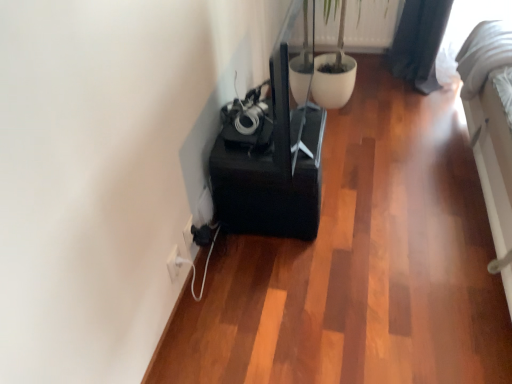
Identify the location of white plastic electric outlet at lower left, marked as the 2th electric outlet in a back-to-front arrangement. (174, 263).

Locate an element on the screen. white plastic electric outlet at lower left, which is the 2th electric outlet in left-to-right order is located at coordinates (190, 239).

What is the approximate height of green matte plant at upper center?

green matte plant at upper center is 32.08 centimeters in height.

Where is `white plastic electric outlet at lower left, marked as the 2th electric outlet in a back-to-front arrangement`? white plastic electric outlet at lower left, marked as the 2th electric outlet in a back-to-front arrangement is located at coordinates (174, 263).

Is white plastic electric outlet at lower left, marked as the 2th electric outlet in a back-to-front arrangement, to the left or to the right of green matte plant at upper center in the image?

white plastic electric outlet at lower left, marked as the 2th electric outlet in a back-to-front arrangement, is to the left of green matte plant at upper center.

Which electric outlet is the 2nd one when counting from the left side of the green matte plant at upper center? Please provide its 2D coordinates.

[(174, 263)]

Does white plastic electric outlet at lower left, which is the 2th electric outlet from right to left, have a larger size compared to green matte plant at upper center?

Incorrect, white plastic electric outlet at lower left, which is the 2th electric outlet from right to left, is not larger than green matte plant at upper center.

Would you consider white plastic electric outlet at lower left, the 2th electric outlet from the front, to be distant from green matte plant at upper center?

Yes, white plastic electric outlet at lower left, the 2th electric outlet from the front, and green matte plant at upper center are located far from each other.

Is white plastic electric outlet at lower left, the 1th electric outlet from the right, positioned with its back to green matte plant at upper center?

That's not correct — white plastic electric outlet at lower left, the 1th electric outlet from the right, is not looking away from green matte plant at upper center.

Is the depth of white plastic electric outlet at lower left, the 1th electric outlet viewed from the back, less than that of green matte plant at upper center?

That is True.

Is green matte plant at upper center wider than white plastic electric outlet at lower left, placed as the 1th electric outlet when sorted from front to back?

Correct, the width of green matte plant at upper center exceeds that of white plastic electric outlet at lower left, placed as the 1th electric outlet when sorted from front to back.

From the image's perspective, is green matte plant at upper center on white plastic electric outlet at lower left, positioned as the 1th electric outlet in left-to-right order?

Correct, green matte plant at upper center appears higher than white plastic electric outlet at lower left, positioned as the 1th electric outlet in left-to-right order, in the image.

Between green matte plant at upper center and white plastic electric outlet at lower left, positioned as the 1th electric outlet in left-to-right order, which one is positioned in front?

Positioned in front is white plastic electric outlet at lower left, positioned as the 1th electric outlet in left-to-right order.

What's the angular difference between white plastic electric outlet at lower left, the 2th electric outlet from the front, and white plastic electric outlet at lower left, which is the 2th electric outlet from right to left,'s facing directions?

The angular difference between white plastic electric outlet at lower left, the 2th electric outlet from the front, and white plastic electric outlet at lower left, which is the 2th electric outlet from right to left, is 0.0151 degrees.

Choose the correct answer: Is white plastic electric outlet at lower left, which is the 2th electric outlet in left-to-right order, inside white plastic electric outlet at lower left, positioned as the 1th electric outlet in left-to-right order, or outside it?

white plastic electric outlet at lower left, which is the 2th electric outlet in left-to-right order, cannot be found inside white plastic electric outlet at lower left, positioned as the 1th electric outlet in left-to-right order.

From a real-world perspective, which is physically above, white plastic electric outlet at lower left, the 1th electric outlet from the right, or white plastic electric outlet at lower left, marked as the 2th electric outlet in a back-to-front arrangement?

white plastic electric outlet at lower left, marked as the 2th electric outlet in a back-to-front arrangement, from a real-world perspective.

Considering the relative sizes of white plastic electric outlet at lower left, the 1th electric outlet viewed from the back, and white plastic electric outlet at lower left, positioned as the 1th electric outlet in left-to-right order, in the image provided, is white plastic electric outlet at lower left, the 1th electric outlet viewed from the back, smaller than white plastic electric outlet at lower left, positioned as the 1th electric outlet in left-to-right order,?

Actually, white plastic electric outlet at lower left, the 1th electric outlet viewed from the back, might be larger than white plastic electric outlet at lower left, positioned as the 1th electric outlet in left-to-right order.

Is white plastic electric outlet at lower left, which is the 2th electric outlet from right to left, at the left side of white plastic electric outlet at lower left, the 1th electric outlet viewed from the back?

Correct, you'll find white plastic electric outlet at lower left, which is the 2th electric outlet from right to left, to the left of white plastic electric outlet at lower left, the 1th electric outlet viewed from the back.

From a real-world perspective, which object stands above the other?

white plastic electric outlet at lower left, placed as the 1th electric outlet when sorted from front to back, is physically above.

Does white plastic electric outlet at lower left, positioned as the 1th electric outlet in left-to-right order, have a lesser height compared to white plastic electric outlet at lower left, which is the 2th electric outlet in left-to-right order?

In fact, white plastic electric outlet at lower left, positioned as the 1th electric outlet in left-to-right order, may be taller than white plastic electric outlet at lower left, which is the 2th electric outlet in left-to-right order.

At what (x,y) coordinates should I click in order to perform the action: click on electric outlet below the white plastic electric outlet at lower left, the 1th electric outlet viewed from the back (from the image's perspective). Please return your answer as a coordinate pair (x, y). This screenshot has height=384, width=512. Looking at the image, I should click on (174, 263).

Does green matte plant at upper center have a greater width compared to white plastic electric outlet at lower left, the 1th electric outlet viewed from the back?

Indeed, green matte plant at upper center has a greater width compared to white plastic electric outlet at lower left, the 1th electric outlet viewed from the back.

Is green matte plant at upper center outside of white plastic electric outlet at lower left, which is the 2th electric outlet in left-to-right order?

Indeed, green matte plant at upper center is completely outside white plastic electric outlet at lower left, which is the 2th electric outlet in left-to-right order.

Is green matte plant at upper center closer to the viewer compared to white plastic electric outlet at lower left, which is the 2th electric outlet in left-to-right order?

No, green matte plant at upper center is behind white plastic electric outlet at lower left, which is the 2th electric outlet in left-to-right order.

Locate an element on the screen. This screenshot has width=512, height=384. the 2nd electric outlet in front of the green matte plant at upper center is located at coordinates (174, 263).

Where is `plant behind the white plastic electric outlet at lower left, the 1th electric outlet from the right`? This screenshot has width=512, height=384. plant behind the white plastic electric outlet at lower left, the 1th electric outlet from the right is located at coordinates (370, 25).

Which object lies further to the anchor point white plastic electric outlet at lower left, positioned as the 1th electric outlet in left-to-right order, white plastic electric outlet at lower left, which is the 2th electric outlet in left-to-right order, or green matte plant at upper center?

green matte plant at upper center is further to white plastic electric outlet at lower left, positioned as the 1th electric outlet in left-to-right order.

Considering their positions, is white plastic electric outlet at lower left, the 1th electric outlet viewed from the back, positioned further to green matte plant at upper center than white plastic electric outlet at lower left, positioned as the 1th electric outlet in left-to-right order?

The object further to green matte plant at upper center is white plastic electric outlet at lower left, positioned as the 1th electric outlet in left-to-right order.

Looking at the image, which one is located further to white plastic electric outlet at lower left, marked as the 2th electric outlet in a back-to-front arrangement, green matte plant at upper center or white plastic electric outlet at lower left, the 1th electric outlet viewed from the back?

green matte plant at upper center is positioned further to the anchor white plastic electric outlet at lower left, marked as the 2th electric outlet in a back-to-front arrangement.

Looking at the image, which one is located further to green matte plant at upper center, white plastic electric outlet at lower left, marked as the 2th electric outlet in a back-to-front arrangement, or white plastic electric outlet at lower left, the 1th electric outlet viewed from the back?

white plastic electric outlet at lower left, marked as the 2th electric outlet in a back-to-front arrangement.

Considering their positions, is white plastic electric outlet at lower left, placed as the 1th electric outlet when sorted from front to back, positioned closer to white plastic electric outlet at lower left, the 1th electric outlet viewed from the back, than green matte plant at upper center?

white plastic electric outlet at lower left, placed as the 1th electric outlet when sorted from front to back, lies closer to white plastic electric outlet at lower left, the 1th electric outlet viewed from the back, than the other object.

Considering their positions, is green matte plant at upper center positioned further to white plastic electric outlet at lower left, which is the 2th electric outlet in left-to-right order, than white plastic electric outlet at lower left, marked as the 2th electric outlet in a back-to-front arrangement?

green matte plant at upper center.

You are a GUI agent. You are given a task and a screenshot of the screen. Output one action in this format:
    pyautogui.click(x=<x>, y=<y>)
    Task: Click on the electric outlet that lies between green matte plant at upper center and white plastic electric outlet at lower left, placed as the 1th electric outlet when sorted from front to back, from top to bottom
    This screenshot has height=384, width=512.
    Given the screenshot: What is the action you would take?
    pyautogui.click(x=190, y=239)